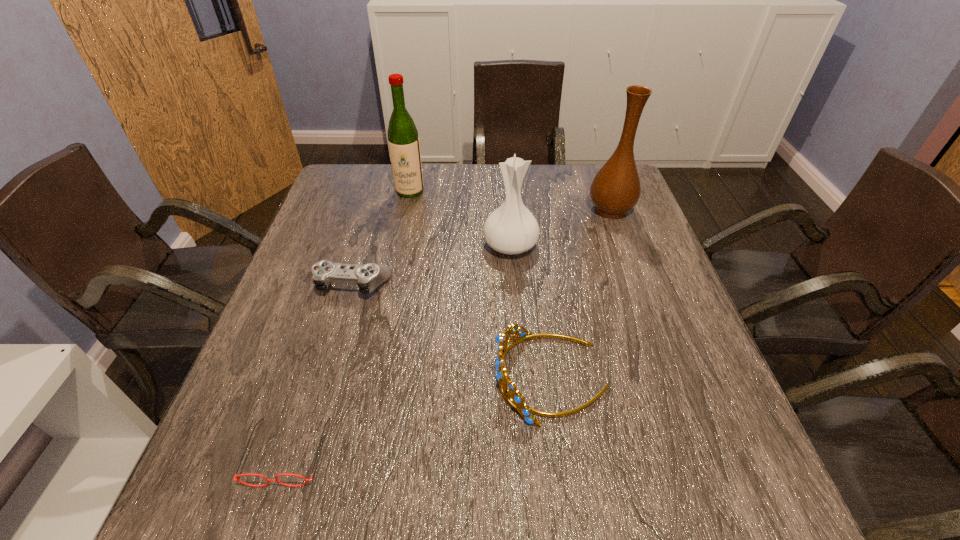
At what (x,y) coordinates should I click in order to perform the action: click on vacant point located on the label of the liquor. Please return your answer as a coordinate pair (x, y). This screenshot has height=540, width=960. Looking at the image, I should click on (403, 224).

In order to click on vacant space located on the front of the nearer vase in this screenshot , I will do `click(518, 350)`.

Where is `free location located on the front-facing side of the fourth tallest object`? This screenshot has width=960, height=540. free location located on the front-facing side of the fourth tallest object is located at coordinates (363, 377).

Locate an element on the screen. The height and width of the screenshot is (540, 960). vacant area situated 0.160m on the front-facing side of the fourth tallest object is located at coordinates (413, 377).

Locate an element on the screen. vacant space positioned 0.290m on the front-facing side of the fourth tallest object is located at coordinates (348, 377).

Find the location of a particular element. The height and width of the screenshot is (540, 960). blank area located on the front of the control is located at coordinates (324, 382).

You are a GUI agent. You are given a task and a screenshot of the screen. Output one action in this format:
    pyautogui.click(x=<x>, y=<y>)
    Task: Click on the vase that is at the far edge
    This screenshot has height=540, width=960.
    Given the screenshot: What is the action you would take?
    pyautogui.click(x=616, y=189)

What are the coordinates of `liquor that is at the far edge` in the screenshot? It's located at (403, 140).

Where is `object located in the near edge section of the desktop`? The width and height of the screenshot is (960, 540). object located in the near edge section of the desktop is located at coordinates (268, 480).

Locate an element on the screen. The width and height of the screenshot is (960, 540). control at the left edge is located at coordinates (368, 277).